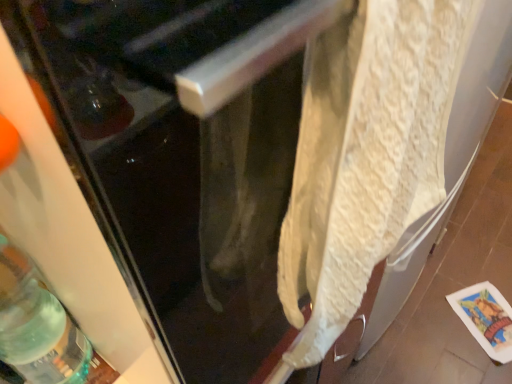
Question: Is white textured towel at right behind white textured towel at center?

Choices:
 (A) no
 (B) yes

Answer: (A)

Question: Could you tell me if white textured towel at right is turned towards white textured towel at center?

Choices:
 (A) yes
 (B) no

Answer: (A)

Question: Is there a large distance between white textured towel at right and white textured towel at center?

Choices:
 (A) no
 (B) yes

Answer: (A)

Question: Considering the relative sizes of white textured towel at right and white textured towel at center in the image provided, is white textured towel at right shorter than white textured towel at center?

Choices:
 (A) no
 (B) yes

Answer: (A)

Question: From the image's perspective, does white textured towel at right appear lower than white textured towel at center?

Choices:
 (A) yes
 (B) no

Answer: (B)

Question: Does white textured towel at right have a lesser width compared to white textured towel at center?

Choices:
 (A) yes
 (B) no

Answer: (B)

Question: Could you tell me if translucent green glass bottle at lower left is facing white textured towel at right?

Choices:
 (A) no
 (B) yes

Answer: (A)

Question: Is translucent green glass bottle at lower left taller than white textured towel at right?

Choices:
 (A) no
 (B) yes

Answer: (A)

Question: Is translucent green glass bottle at lower left positioned behind white textured towel at right?

Choices:
 (A) yes
 (B) no

Answer: (A)

Question: Is translucent green glass bottle at lower left outside white textured towel at right?

Choices:
 (A) yes
 (B) no

Answer: (A)

Question: Would you say translucent green glass bottle at lower left contains white textured towel at right?

Choices:
 (A) no
 (B) yes

Answer: (A)

Question: Considering the relative sizes of translucent green glass bottle at lower left and white textured towel at right in the image provided, is translucent green glass bottle at lower left smaller than white textured towel at right?

Choices:
 (A) yes
 (B) no

Answer: (A)

Question: Is translucent green glass bottle at lower left looking in the opposite direction of white textured towel at center?

Choices:
 (A) yes
 (B) no

Answer: (B)